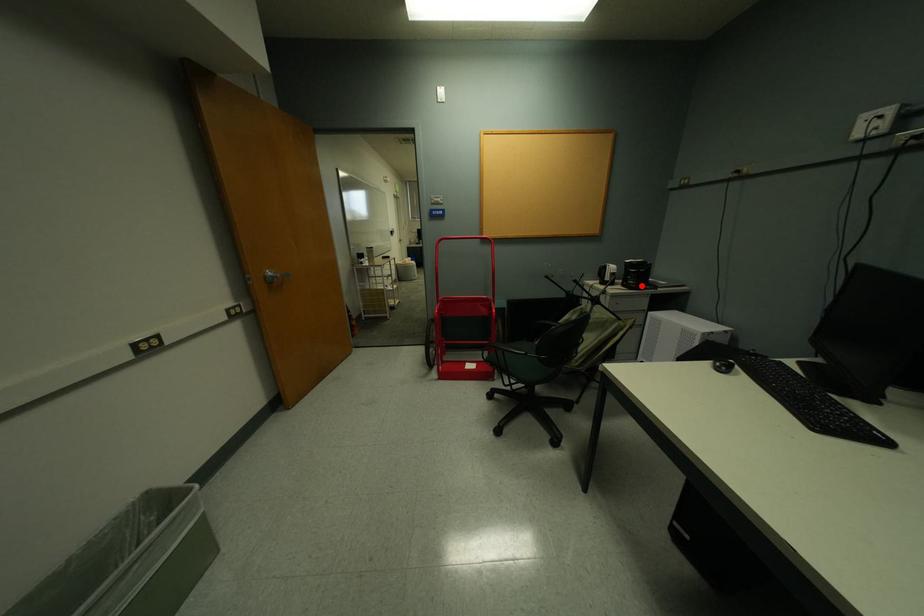
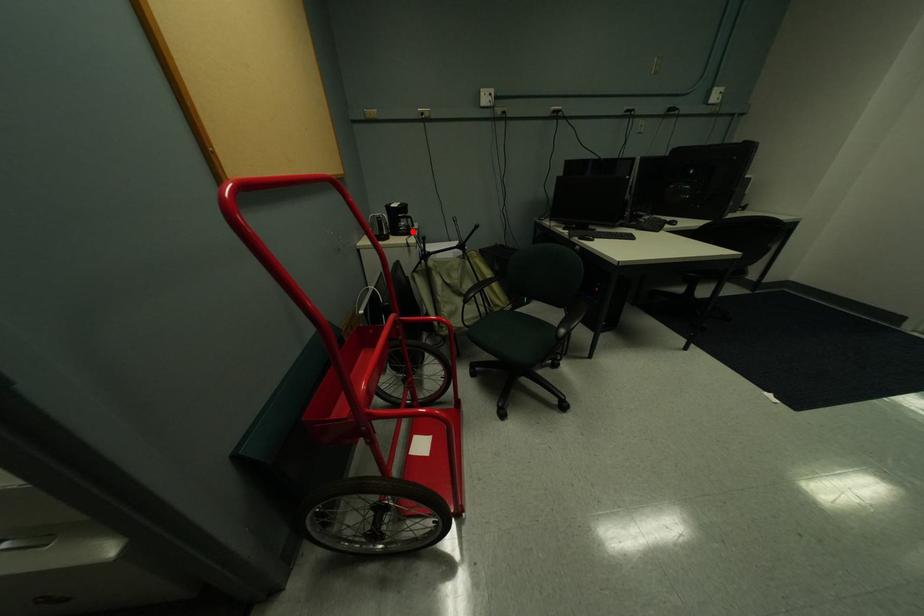
I am providing you with two images of the same scene from different viewpoints. A red point is marked on the first image and another point is marked on the second image. Are the points marked in image1 and image2 representing the same 3D position?

Yes